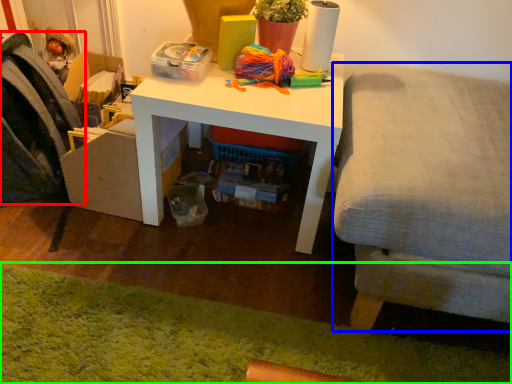
Question: Which object is positioned farthest from swivel chair (highlighted by a red box)? Select from studio couch (highlighted by a blue box) and mat (highlighted by a green box).

Choices:
 (A) studio couch
 (B) mat

Answer: (A)